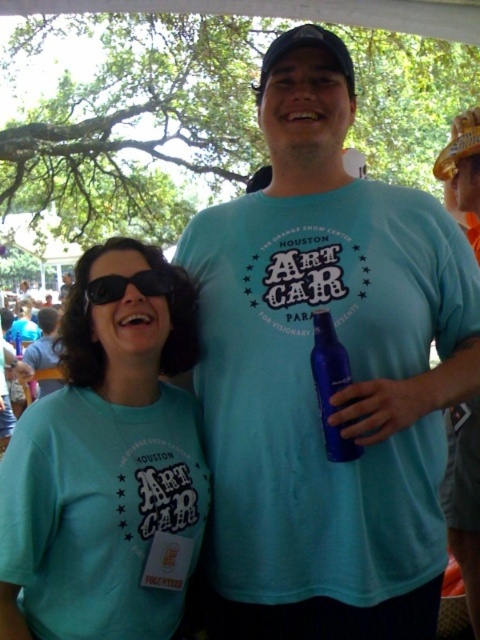
Is light blue t-shirt at center below matte blue shirt at left?

No, light blue t-shirt at center is not below matte blue shirt at left.

Can you confirm if light blue t-shirt at center is positioned to the right of matte blue shirt at left?

Indeed, light blue t-shirt at center is positioned on the right side of matte blue shirt at left.

At what (x,y) coordinates should I click in order to perform the action: click on light blue t-shirt at center. Please return your answer as a coordinate pair (x, y). Looking at the image, I should click on (312, 380).

Locate an element on the screen. light blue t-shirt at center is located at coordinates (312, 380).

In the scene shown: Is light blue t-shirt at center below blue plastic bottle at center?

Actually, light blue t-shirt at center is above blue plastic bottle at center.

Between light blue t-shirt at center and blue plastic bottle at center, which one has less height?

Standing shorter between the two is blue plastic bottle at center.

Between point (247, 532) and point (334, 442), which one is positioned behind?

The point (247, 532) is behind.

Image resolution: width=480 pixels, height=640 pixels. I want to click on light blue t-shirt at center, so click(x=312, y=380).

Does blue plastic bottle at center appear on the right side of black matte goggles at center?

Yes, blue plastic bottle at center is to the right of black matte goggles at center.

Which is more to the left, blue plastic bottle at center or black matte goggles at center?

black matte goggles at center

Find the location of a particular element. The image size is (480, 640). blue plastic bottle at center is located at coordinates [331, 385].